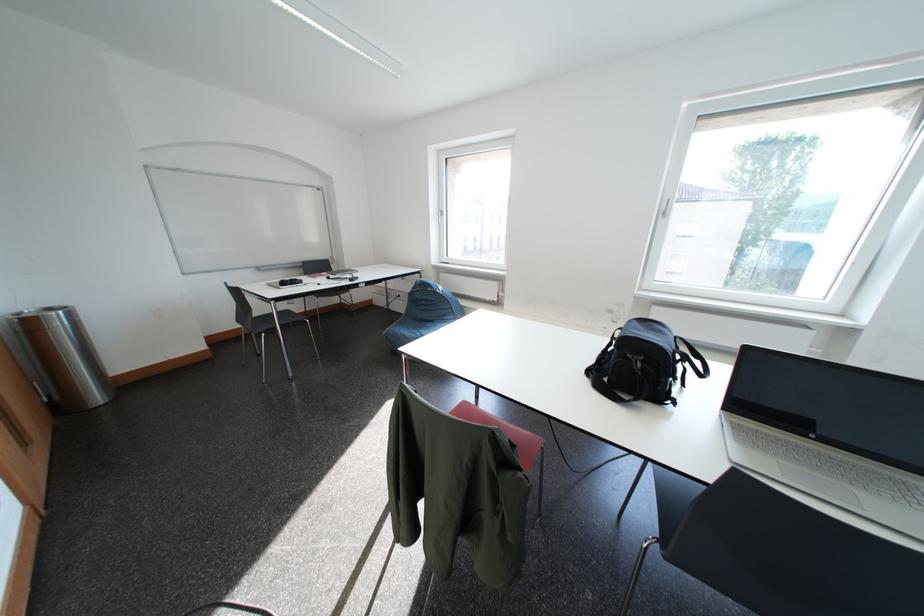
The image size is (924, 616). What are the coordinates of `white window handle` in the screenshot? It's located at [x=664, y=208].